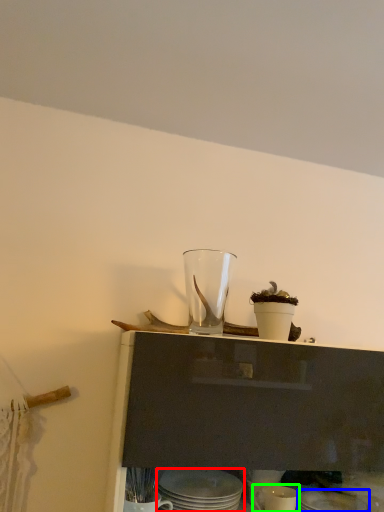
Question: Which is farther away from tableware (highlighted by a red box)? tableware (highlighted by a blue box) or tableware (highlighted by a green box)?

Choices:
 (A) tableware
 (B) tableware

Answer: (A)